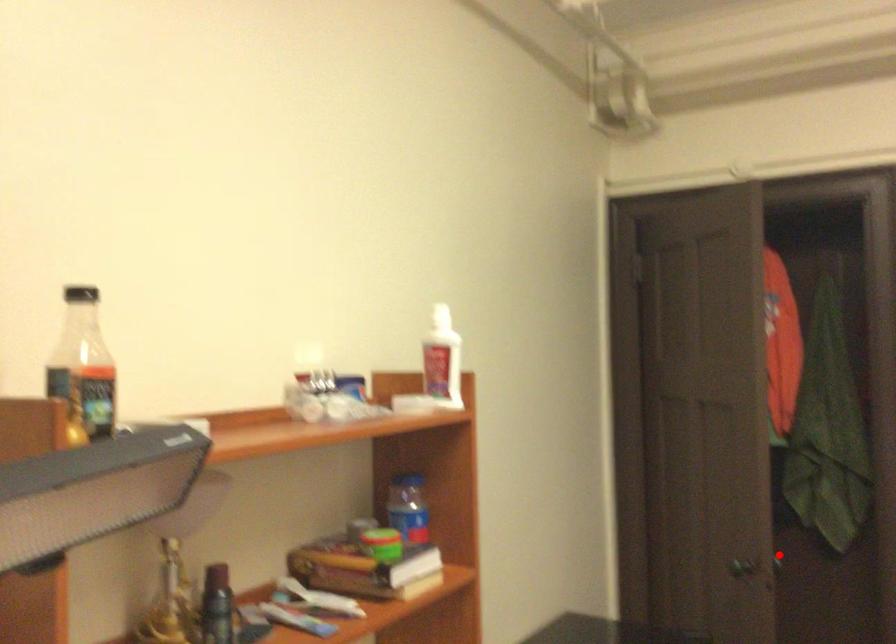
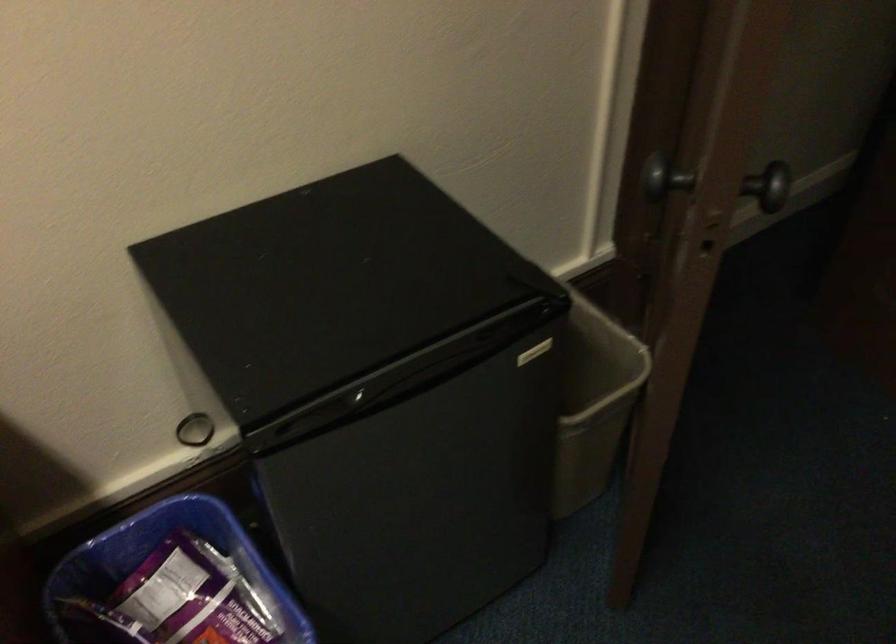
Question: I am providing you with two images of the same scene from different viewpoints. In image1, a red point is highlighted. Considering the same 3D point in image2, which of the following is correct?

Choices:
 (A) It is closer
 (B) It is farther

Answer: (A)